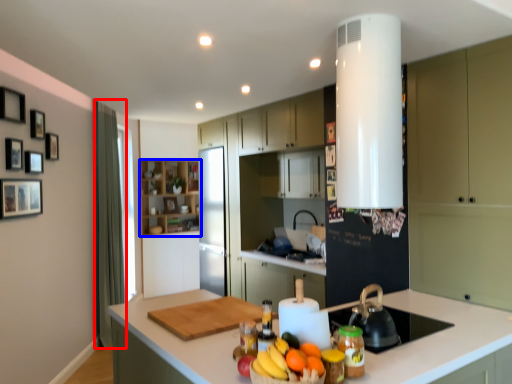
Question: Which of the following is the farthest to the observer, curtain (highlighted by a red box) or cabinetry (highlighted by a blue box)?

Choices:
 (A) curtain
 (B) cabinetry

Answer: (B)